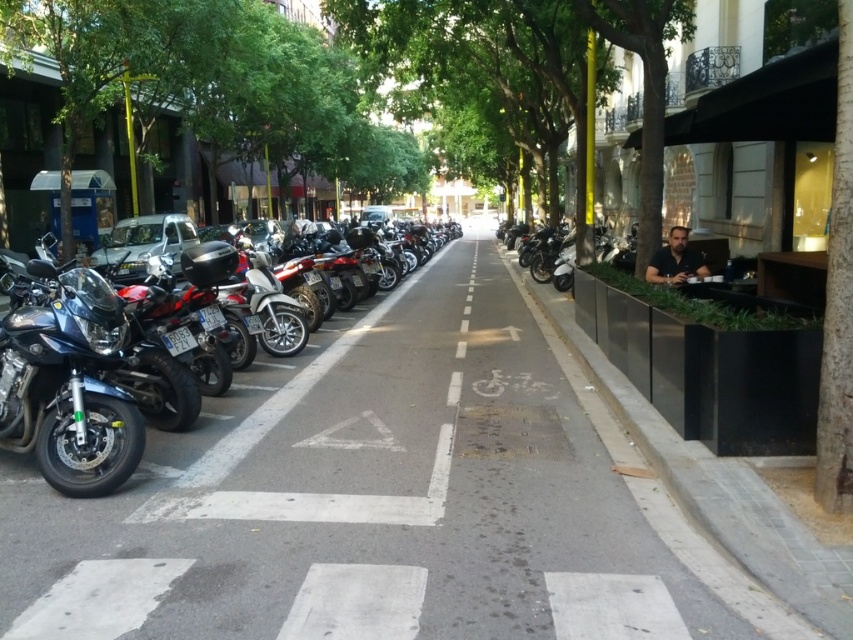
From the picture: Does gray asphalt at center have a greater height compared to black concrete curb at right?

Indeed, gray asphalt at center has a greater height compared to black concrete curb at right.

Which is more to the right, gray asphalt at center or black concrete curb at right?

black concrete curb at right is more to the right.

Identify the location of gray asphalt at center. click(x=386, y=500).

This screenshot has width=853, height=640. What are the coordinates of `gray asphalt at center` in the screenshot? It's located at (386, 500).

Who is shorter, gray asphalt at center or green leafy tree at right?

gray asphalt at center

How much distance is there between gray asphalt at center and green leafy tree at right?

gray asphalt at center is 8.42 feet away from green leafy tree at right.

Which is in front, point (593, 468) or point (645, 200)?

Point (593, 468) is more forward.

Where is `gray asphalt at center`? Image resolution: width=853 pixels, height=640 pixels. gray asphalt at center is located at coordinates (386, 500).

Does gray asphalt at center appear over shiny black motorcycle at left?

No, gray asphalt at center is not above shiny black motorcycle at left.

Does point (426, 404) come farther from viewer compared to point (183, 458)?

Yes, point (426, 404) is farther from viewer.

Identify the location of gray asphalt at center. (386, 500).